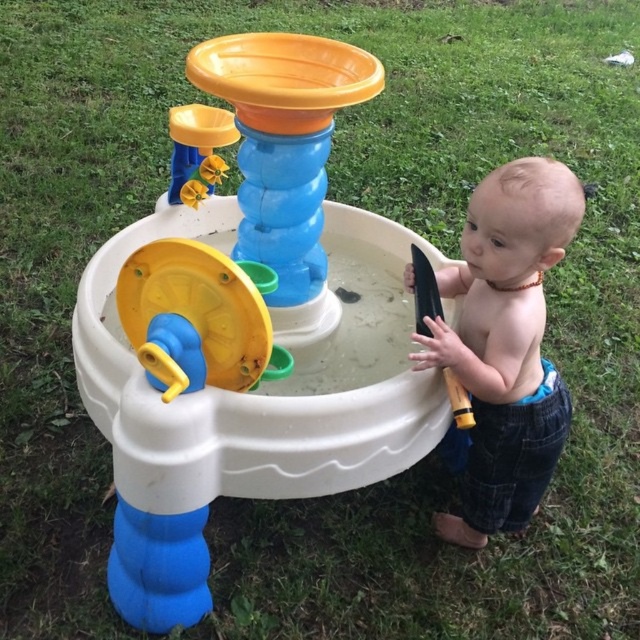
You are a parent watching your child play with the water table. You notice the smooth tan skin at right and the yellow plastic wheel at center. Which object is closer to you?

The smooth tan skin at right is closer to you because it is further to the viewer than the yellow plastic wheel at center.

You are a parent trying to ensure your child stays safe while playing. The white plastic water table at center and the smooth tan skin at right are both in the scene. Which object is closer to you, the parent, so you can monitor it better?

The white plastic water table at center is closer to the viewer than the smooth tan skin at right, so you can monitor it better.